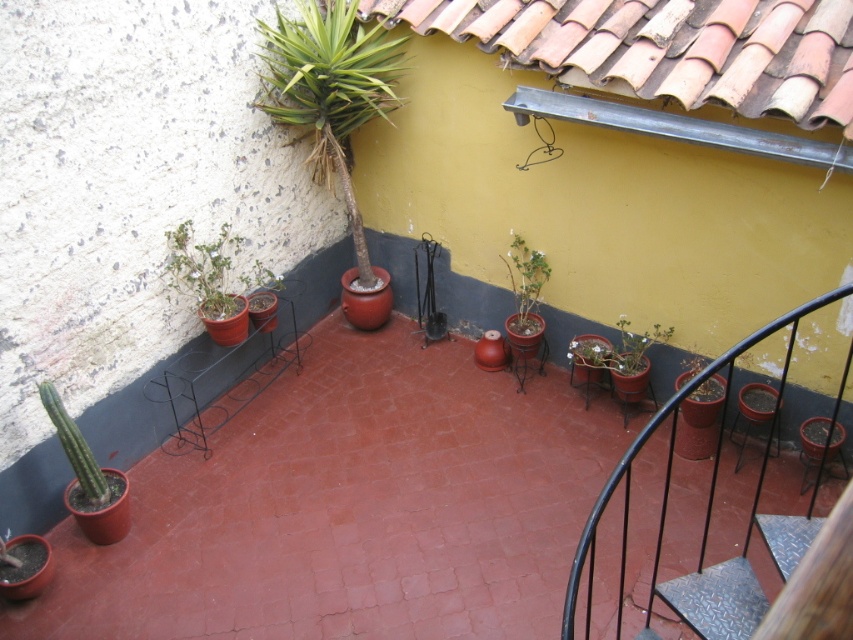
You are a delivery person standing at the entrance of the patio. You need to place a package that is 8 feet long on the ground between the white textured wall on the left and the metallic diamond plate at lower right. Is there enough space for the package?

The distance between the white textured wall on the left and the metallic diamond plate at lower right is 7.55 feet. Since the package is 8 feet long, it is slightly longer than the available space. Therefore, the package cannot be placed there without overlapping the edges.